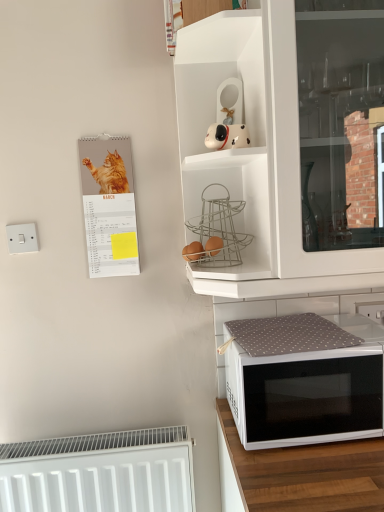
The image size is (384, 512). I want to click on matte paper calendar at left, so (x=109, y=206).

The height and width of the screenshot is (512, 384). In order to click on white plastic electric outlet at upper right in this screenshot , I will do `click(371, 310)`.

The width and height of the screenshot is (384, 512). Identify the location of matte paper calendar at left. (109, 206).

Would you say brown matte eggs at center, the 1th food from the right, contains matte paper calendar at left?

No, matte paper calendar at left is not surrounded by brown matte eggs at center, the 1th food from the right.

Considering the sizes of brown matte eggs at center, positioned as the second food in left-to-right order, and matte paper calendar at left in the image, is brown matte eggs at center, positioned as the second food in left-to-right order, bigger or smaller than matte paper calendar at left?

Clearly, brown matte eggs at center, positioned as the second food in left-to-right order, is smaller in size than matte paper calendar at left.

Considering the positions of objects brown matte eggs at center, positioned as the second food in left-to-right order, and matte paper calendar at left in the image provided, who is more to the left, brown matte eggs at center, positioned as the second food in left-to-right order, or matte paper calendar at left?

matte paper calendar at left is more to the left.

Who is more distant, white matte cabinet at upper center or matte paper calendar at left?

white matte cabinet at upper center.

The height and width of the screenshot is (512, 384). There is a white matte cabinet at upper center. What are the coordinates of `bulletin board above it (from a real-world perspective)` in the screenshot? It's located at (109, 206).

Looking at this image, is matte paper calendar at left inside white matte cabinet at upper center?

No, matte paper calendar at left is not a part of white matte cabinet at upper center.

Would you consider white matte cabinet at upper center to be distant from matte paper calendar at left?

white matte cabinet at upper center is actually quite close to matte paper calendar at left.

In the scene shown: From the image's perspective, is white matte cabinet at upper center beneath white fabric-covered microwave at lower right?

→ Actually, white matte cabinet at upper center appears above white fabric-covered microwave at lower right in the image.

Is point (257, 259) behind point (225, 354)?

No, (257, 259) is closer to viewer.

Which of these two, white matte cabinet at upper center or white fabric-covered microwave at lower right, stands shorter?

Standing shorter between the two is white fabric-covered microwave at lower right.

Is white matte cabinet at upper center facing towards white fabric-covered microwave at lower right?

Yes, white matte cabinet at upper center faces towards white fabric-covered microwave at lower right.

Considering their positions, is white matte cabinet at upper center located in front of or behind white matte dog figurine at upper center?

white matte cabinet at upper center is behind white matte dog figurine at upper center.

Is white matte dog figurine at upper center at the back of white matte cabinet at upper center?

That's right, white matte cabinet at upper center is facing away from white matte dog figurine at upper center.

Which object is positioned more to the right, white matte cabinet at upper center or white matte dog figurine at upper center?

From the viewer's perspective, white matte cabinet at upper center appears more on the right side.

Considering the positions of objects white matte cabinet at upper center and white matte radiator at lower left in the image provided, who is more to the right, white matte cabinet at upper center or white matte radiator at lower left?

white matte cabinet at upper center.

Would you say white matte cabinet at upper center contains white matte radiator at lower left?

No, white matte cabinet at upper center does not contain white matte radiator at lower left.

Are white matte cabinet at upper center and white matte radiator at lower left located far from each other?

white matte cabinet at upper center is actually quite close to white matte radiator at lower left.

This screenshot has height=512, width=384. Find the location of `radiator in front of the white matte cabinet at upper center`. radiator in front of the white matte cabinet at upper center is located at coordinates (100, 473).

From a real-world perspective, is white fabric-covered microwave at lower right on white matte radiator at lower left?

Yes, from a real-world perspective, white fabric-covered microwave at lower right is above white matte radiator at lower left.

Based on their positions, is white fabric-covered microwave at lower right located to the left or right of white matte radiator at lower left?

white fabric-covered microwave at lower right is positioned on white matte radiator at lower left's right side.

Is white fabric-covered microwave at lower right turned away from white matte radiator at lower left?

No, white fabric-covered microwave at lower right is not facing away from white matte radiator at lower left.

Can you confirm if white fabric-covered microwave at lower right is thinner than white matte radiator at lower left?

Incorrect, the width of white fabric-covered microwave at lower right is not less than that of white matte radiator at lower left.

Is white matte radiator at lower left far away from brown matte eggs at upper center, which appears as the 1th food when viewed from the left?

No, there isn't a large distance between white matte radiator at lower left and brown matte eggs at upper center, which appears as the 1th food when viewed from the left.

From a real-world perspective, between white matte radiator at lower left and brown matte eggs at upper center, the 2th food positioned from the right, who is vertically higher?

brown matte eggs at upper center, the 2th food positioned from the right, from a real-world perspective.

Based on their sizes in the image, would you say white matte radiator at lower left is bigger or smaller than brown matte eggs at upper center, the 2th food positioned from the right?

Clearly, white matte radiator at lower left is larger in size than brown matte eggs at upper center, the 2th food positioned from the right.

From their relative heights in the image, would you say white matte radiator at lower left is taller or shorter than brown matte eggs at upper center, the 2th food positioned from the right?

Clearly, white matte radiator at lower left is taller compared to brown matte eggs at upper center, the 2th food positioned from the right.

Which food is the 2nd one when counting from the right side of the matte paper calendar at left? Please provide its 2D coordinates.

[(213, 246)]

In the image, there is a white matte cabinet at upper center. In order to click on bulletin board above it (from the image's perspective) in this screenshot , I will do `click(109, 206)`.

Looking at the image, which one is located further to white plastic electric outlet at upper right, brown matte eggs at center, the 1th food from the right, or white matte radiator at lower left?

Based on the image, white matte radiator at lower left appears to be further to white plastic electric outlet at upper right.

Looking at the image, which one is located closer to matte paper calendar at left, white matte cabinet at upper center or white plastic electric outlet at upper right?

Based on the image, white matte cabinet at upper center appears to be nearer to matte paper calendar at left.

When comparing their distances from white matte dog figurine at upper center, does white matte cabinet at upper center or white plastic electric outlet at upper right seem closer?

Based on the image, white matte cabinet at upper center appears to be nearer to white matte dog figurine at upper center.

From the image, which object appears to be nearer to white plastic electric outlet at upper right, brown matte eggs at center, the 1th food from the right, or brown matte eggs at upper center, the 2th food positioned from the right?

brown matte eggs at center, the 1th food from the right, lies closer to white plastic electric outlet at upper right than the other object.

Based on their spatial positions, is white matte radiator at lower left or matte paper calendar at left further from white matte cabinet at upper center?

white matte radiator at lower left is positioned further to the anchor white matte cabinet at upper center.

Which object lies further to the anchor point matte paper calendar at left, white matte dog figurine at upper center or brown matte eggs at center, positioned as the second food in left-to-right order?

white matte dog figurine at upper center.

Considering their positions, is white fabric-covered microwave at lower right positioned closer to white matte dog figurine at upper center than white matte radiator at lower left?

Based on the image, white fabric-covered microwave at lower right appears to be nearer to white matte dog figurine at upper center.

From the image, which object appears to be nearer to brown matte eggs at center, the 1th food from the right, white fabric-covered microwave at lower right or white matte dog figurine at upper center?

white matte dog figurine at upper center.

You are a GUI agent. You are given a task and a screenshot of the screen. Output one action in this format:
    pyautogui.click(x=<x>, y=<y>)
    Task: Click on the microwave oven that lies between brown matte eggs at center, the 1th food from the right, and white matte radiator at lower left from top to bottom
    The width and height of the screenshot is (384, 512).
    Given the screenshot: What is the action you would take?
    pyautogui.click(x=309, y=391)

Identify the location of toy located between matte paper calendar at left and white matte cabinet at upper center in the left-right direction. pyautogui.click(x=228, y=118).

The image size is (384, 512). I want to click on food situated between matte paper calendar at left and brown matte eggs at center, positioned as the second food in left-to-right order, from left to right, so click(x=193, y=251).

Identify the location of microwave oven between brown matte eggs at upper center, the 2th food positioned from the right, and white matte radiator at lower left from top to bottom. The width and height of the screenshot is (384, 512). (309, 391).